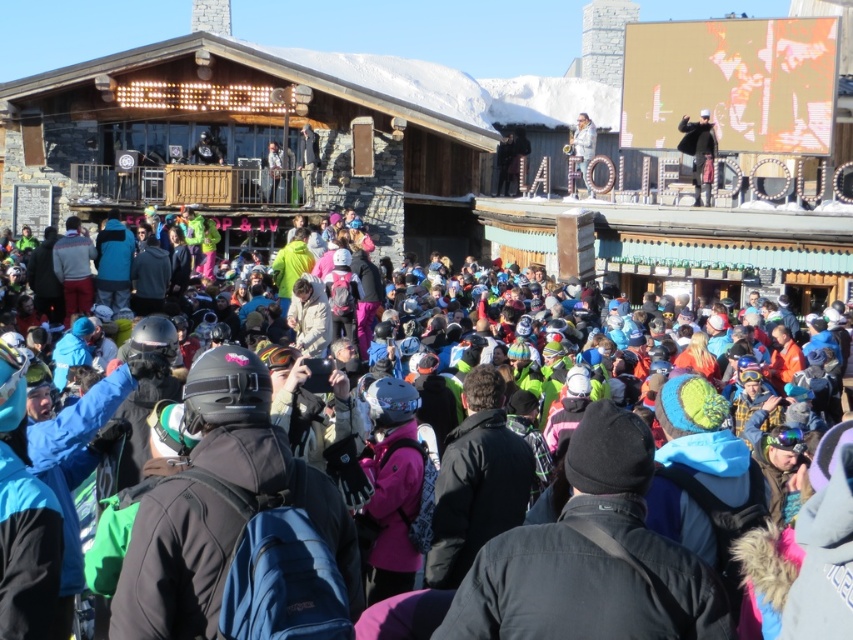
You are a photographer trying to capture a wide shot of the wooden ski resort at center and the multicolored fabric crowd at center. Based on their sizes, which one should you frame first to ensure both are fully visible in the photo?

The wooden ski resort at center might be wider than multicolored fabric crowd at center, so you should frame the wooden ski resort at center first to ensure it fits within the shot before adjusting for the crowd.